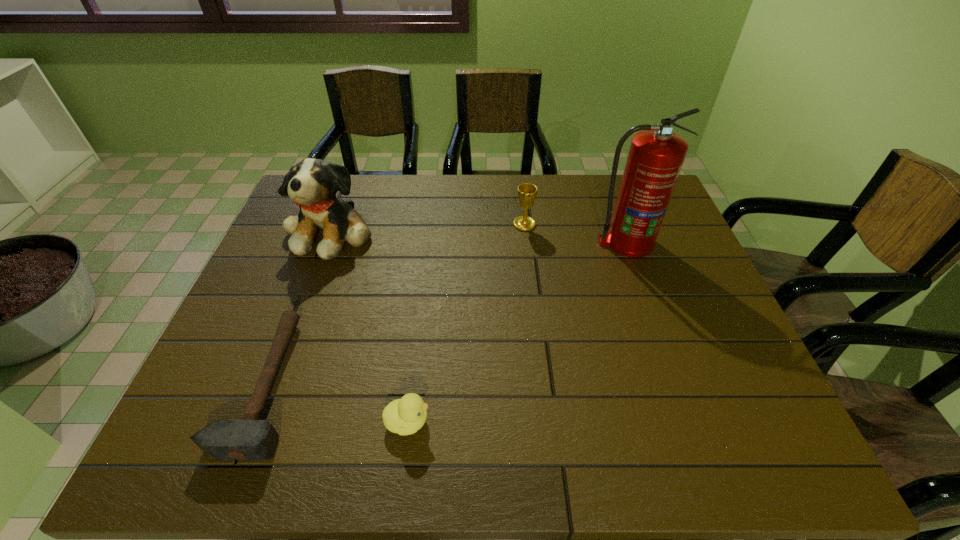
Identify the location of vacant area located 0.250m on the right of the second object from right to left. The image size is (960, 540). (618, 224).

The height and width of the screenshot is (540, 960). Find the location of `free space located at the beak of the second shortest object`. free space located at the beak of the second shortest object is located at coordinates (555, 421).

Locate an element on the screen. free space located on the striking surface of the hammer is located at coordinates (368, 384).

The height and width of the screenshot is (540, 960). I want to click on puppy at the far edge, so click(x=312, y=183).

The image size is (960, 540). I want to click on chalice that is at the far edge, so click(x=526, y=192).

Locate an element on the screen. duckling that is at the near edge is located at coordinates (405, 416).

Identify the location of hammer at the near edge. This screenshot has width=960, height=540. 250,438.

Locate an element on the screen. puppy at the left edge is located at coordinates (312, 183).

Where is `hammer present at the left edge`? The width and height of the screenshot is (960, 540). hammer present at the left edge is located at coordinates (250, 438).

This screenshot has width=960, height=540. In order to click on object present at the right edge in this screenshot , I will do `click(656, 155)`.